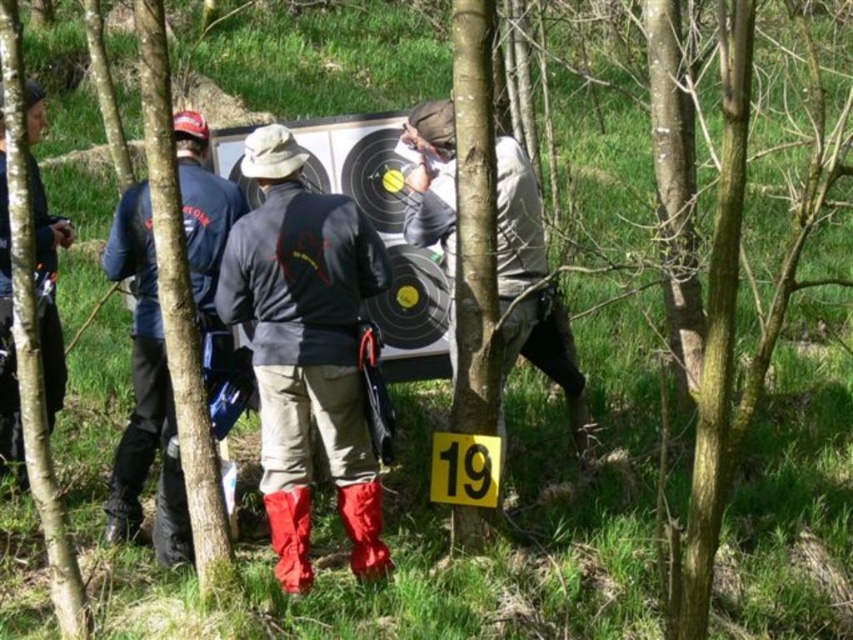
Is dark gray leather jacket at center wider than red rubber boot at lower center?

Correct, the width of dark gray leather jacket at center exceeds that of red rubber boot at lower center.

Does dark gray leather jacket at center have a larger size compared to red rubber boot at lower center?

Correct, dark gray leather jacket at center is larger in size than red rubber boot at lower center.

You are a GUI agent. You are given a task and a screenshot of the screen. Output one action in this format:
    pyautogui.click(x=<x>, y=<y>)
    Task: Click on the dark gray leather jacket at center
    The height and width of the screenshot is (640, 853).
    Given the screenshot: What is the action you would take?
    pyautogui.click(x=305, y=348)

Between dark blue jacket at left and red rubber boot at lower center, which one has less height?

Standing shorter between the two is red rubber boot at lower center.

Is dark blue jacket at left bigger than red rubber boot at lower center?

Yes, dark blue jacket at left is bigger than red rubber boot at lower center.

Who is more distant from viewer, (32, 186) or (379, 570)?

Positioned behind is point (32, 186).

Identify the location of dark blue jacket at left. This screenshot has height=640, width=853. (48, 291).

Based on the photo, which of these two, dark blue jacket at left or rubber/mesh boot at lower left, stands taller?

dark blue jacket at left

Is point (28, 134) farther from camera compared to point (112, 502)?

No.

Between point (53, 337) and point (131, 520), which one is positioned in front?

Point (131, 520) is more forward.

Find the location of a particular element. dark blue jacket at left is located at coordinates (48, 291).